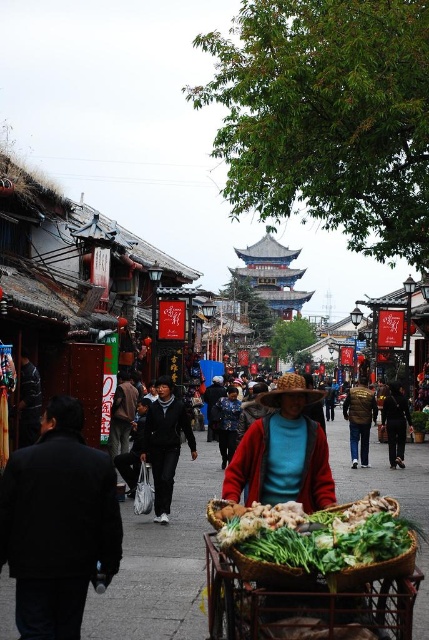
Question: Among these points, which one is farthest from the camera?

Choices:
 (A) (257, 433)
 (B) (290, 545)
 (C) (123, 621)
 (D) (401, 440)

Answer: (D)

Question: Which object appears farthest from the camera in this image?

Choices:
 (A) green leafy vegetables at center
 (B) dark brown leather jacket at center
 (C) green leafy vegetables at lower center

Answer: (B)

Question: Can you confirm if green leafy vegetables at center is positioned above red knitted hat at center?

Choices:
 (A) yes
 (B) no

Answer: (B)

Question: Which point is farther to the camera?

Choices:
 (A) (250, 460)
 (B) (392, 608)

Answer: (A)

Question: Is green leafy vegetables at center further to camera compared to red knitted hat at center?

Choices:
 (A) yes
 (B) no

Answer: (B)

Question: From the image, what is the correct spatial relationship of green leafy vegetables at lower center in relation to green leafy vegetables at center?

Choices:
 (A) left
 (B) right

Answer: (A)